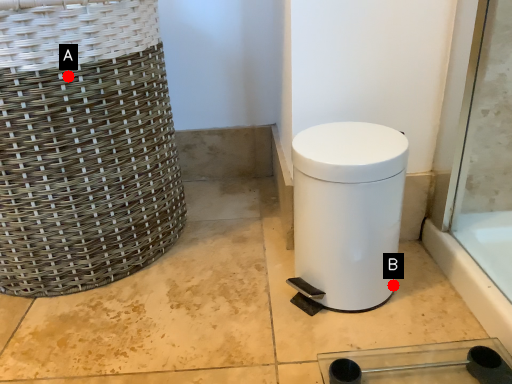
Question: Two points are circled on the image, labeled by A and B beside each circle. Among these points, which one is nearest to the camera?

Choices:
 (A) A is closer
 (B) B is closer

Answer: (A)